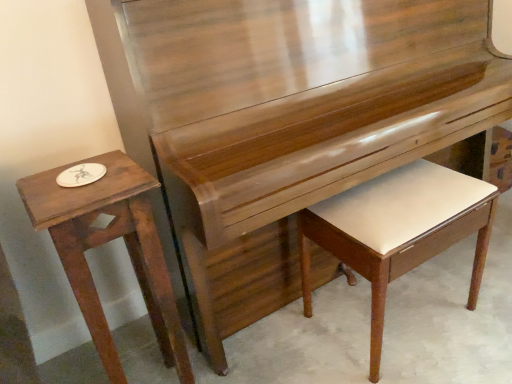
Where is `free point below white leather music stool at lower right (from a real-world perspective)`? Image resolution: width=512 pixels, height=384 pixels. free point below white leather music stool at lower right (from a real-world perspective) is located at coordinates (409, 321).